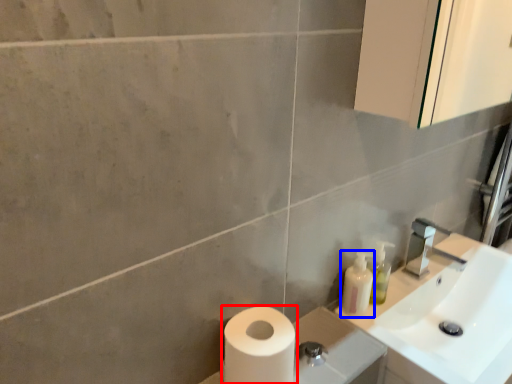
Question: Which point is further to the camera, toilet paper (highlighted by a red box) or toiletry (highlighted by a blue box)?

Choices:
 (A) toilet paper
 (B) toiletry

Answer: (B)